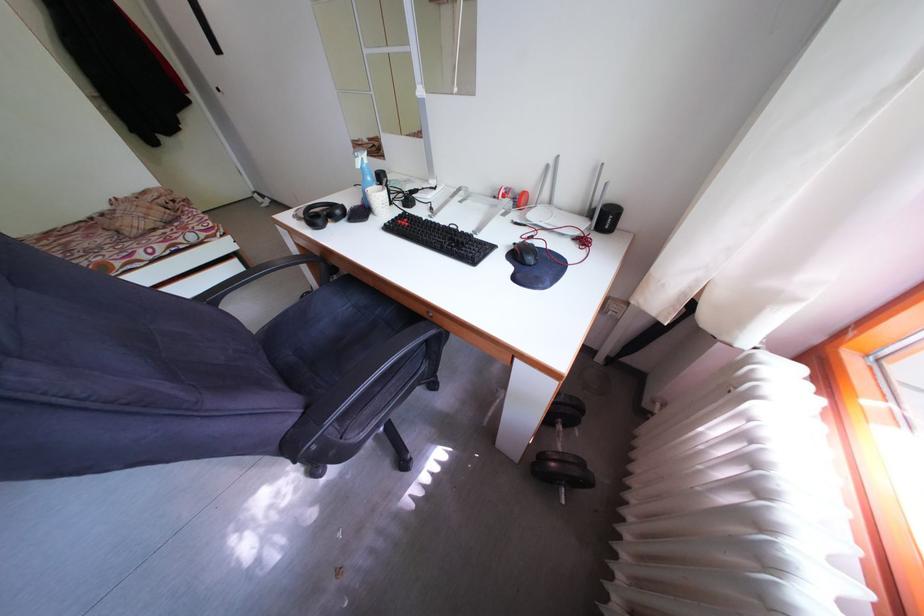
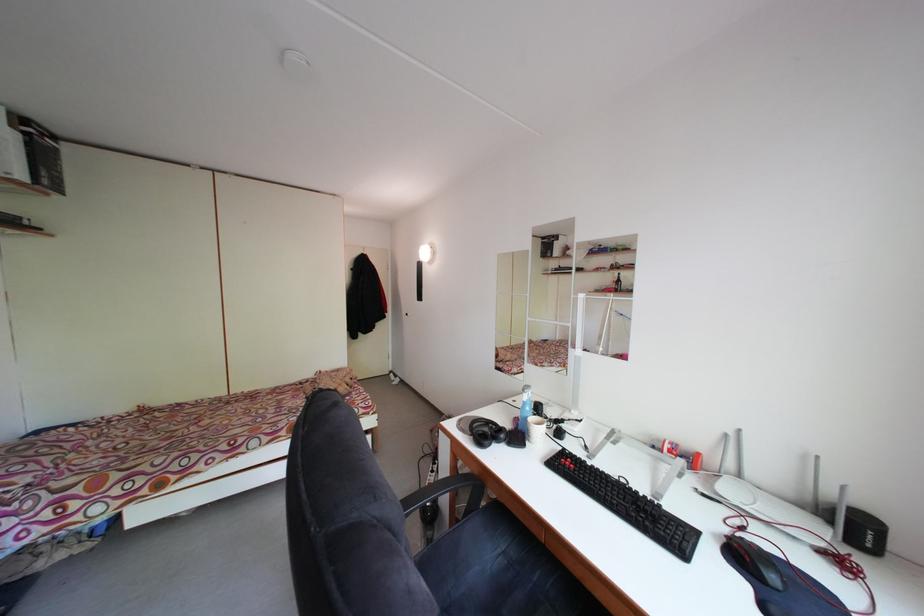
In the second image, find the point that corresponds to [614,225] in the first image.

(865, 535)